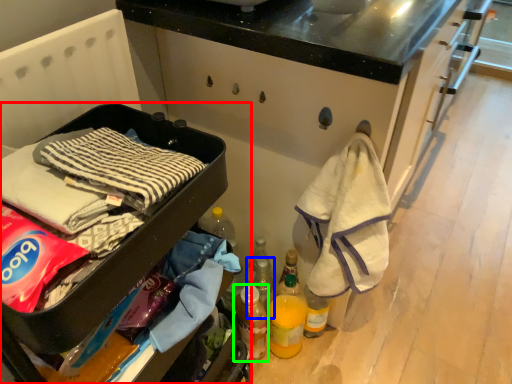
Question: Based on their relative distances, which object is farther from furniture (highlighted by a red box)? Choose from bottle (highlighted by a blue box) and bottle (highlighted by a green box).

Choices:
 (A) bottle
 (B) bottle

Answer: (A)